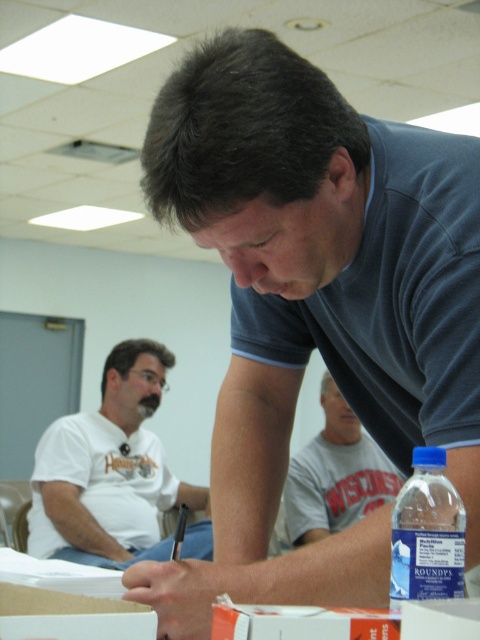
You are standing in the conference room and see two points marked in the image. Which point, point (284, 499) or point (444, 593), is closer to you?

Point (284, 499) is closer to you because it is further to the viewer than point (444, 593).